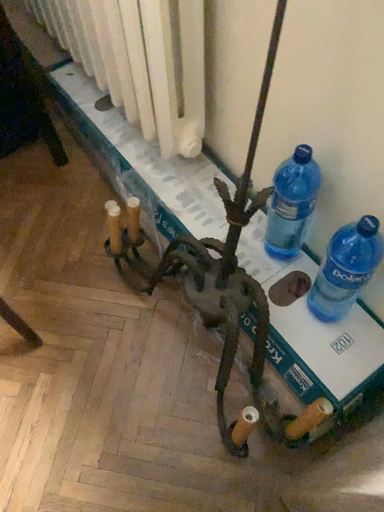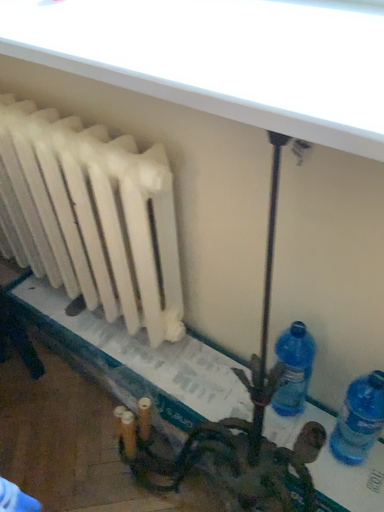
Question: Which way did the camera rotate in the video?

Choices:
 (A) rotated upward
 (B) rotated downward

Answer: (A)